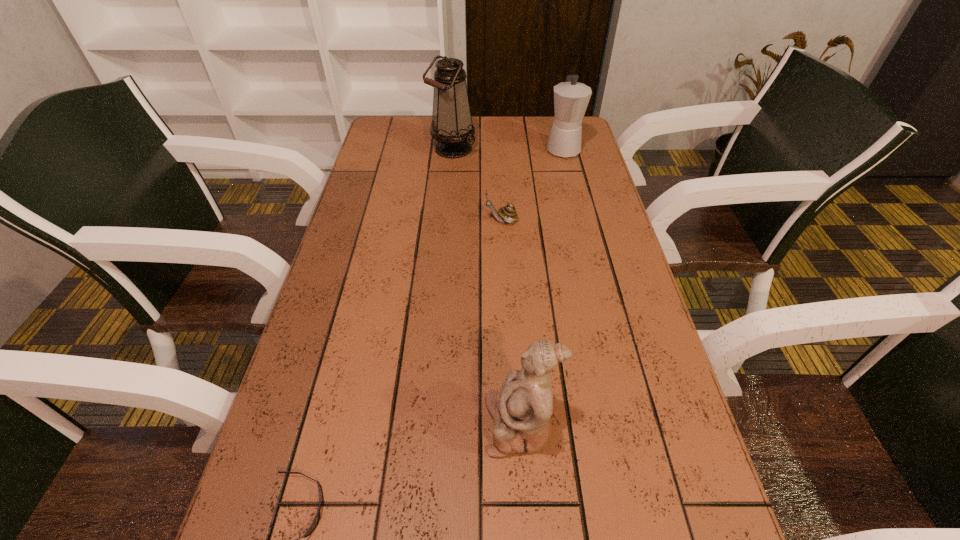
The height and width of the screenshot is (540, 960). I want to click on vacant space at the right edge of the desktop, so click(x=636, y=441).

The image size is (960, 540). Identify the location of unoccupied position between the third farthest object and the coffeepot. (533, 185).

Identify the location of unoccupied area between the third farthest object and the fourth object from right to left. Image resolution: width=960 pixels, height=540 pixels. (477, 185).

At what (x,y) coordinates should I click in order to perform the action: click on blank region between the second shortest object and the fourth farthest object. Please return your answer as a coordinate pair (x, y). The width and height of the screenshot is (960, 540). Looking at the image, I should click on (511, 323).

The width and height of the screenshot is (960, 540). Find the location of `blank region between the third nearest object and the rightmost object`. blank region between the third nearest object and the rightmost object is located at coordinates (533, 185).

Locate an element on the screen. This screenshot has height=540, width=960. vacant space in between the coffeepot and the third farthest object is located at coordinates (533, 185).

Identify the location of free space between the tallest object and the coffeepot. Image resolution: width=960 pixels, height=540 pixels. (508, 149).

Find the location of a particular element. Image resolution: width=960 pixels, height=540 pixels. empty space that is in between the third farthest object and the fourth farthest object is located at coordinates (511, 323).

The image size is (960, 540). What are the coordinates of `object identified as the second closest to the tallest object` in the screenshot? It's located at (508, 213).

Identify which object is located as the third nearest to the oil lamp. Please provide its 2D coordinates. Your answer should be formatted as a tuple, i.e. [(x, y)], where the tuple contains the x and y coordinates of a point satisfying the conditions above.

[(521, 410)]